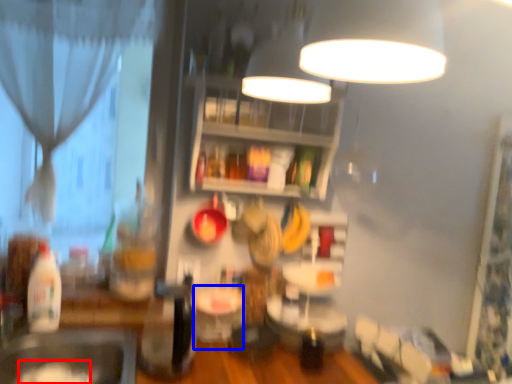
Question: Which object appears farthest to the camera in this image, food (highlighted by a red box) or table (highlighted by a blue box)?

Choices:
 (A) food
 (B) table

Answer: (B)